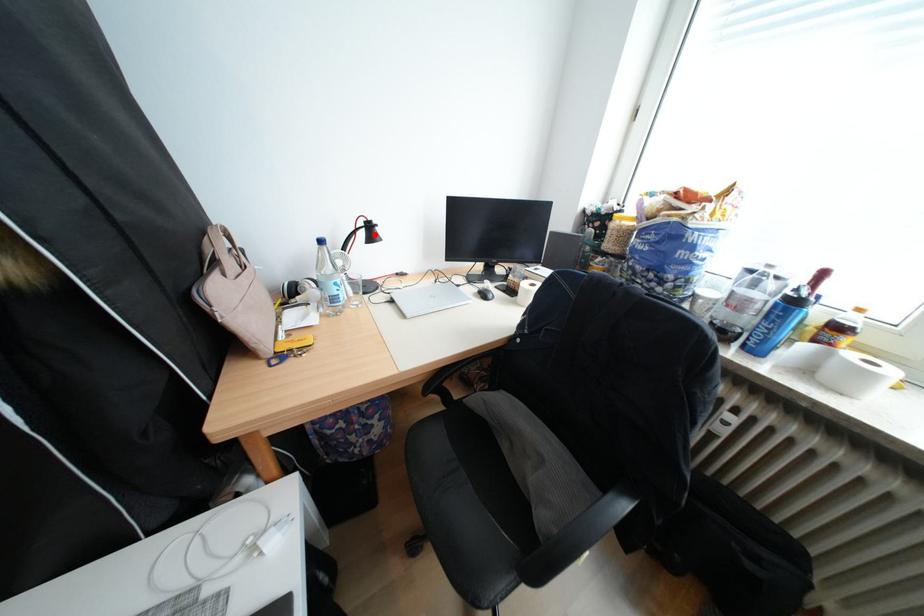
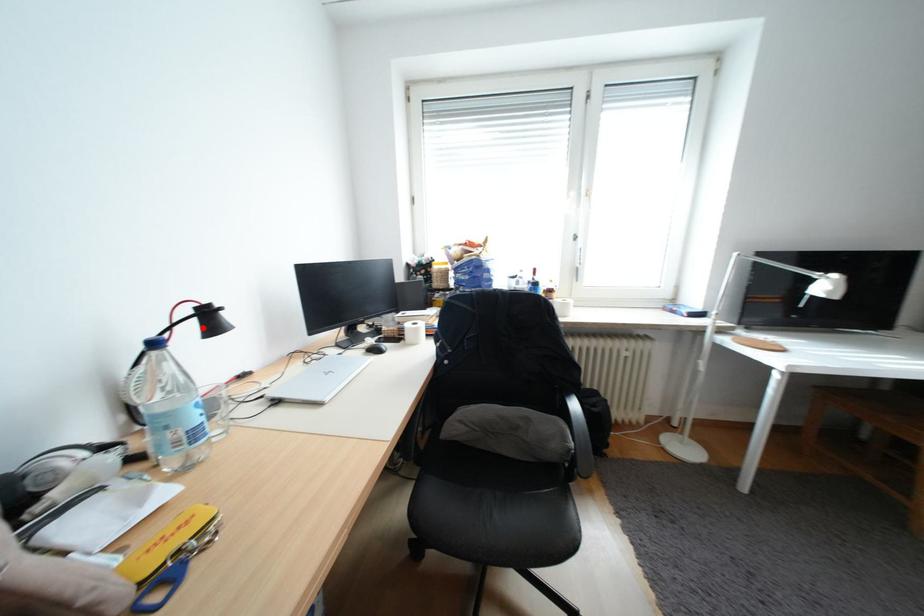
I am providing you with two images of the same scene from different viewpoints. A red point is marked on the first image and another point is marked on the second image. Is the marked point in image1 the same physical position as the marked point in image2?

Yes